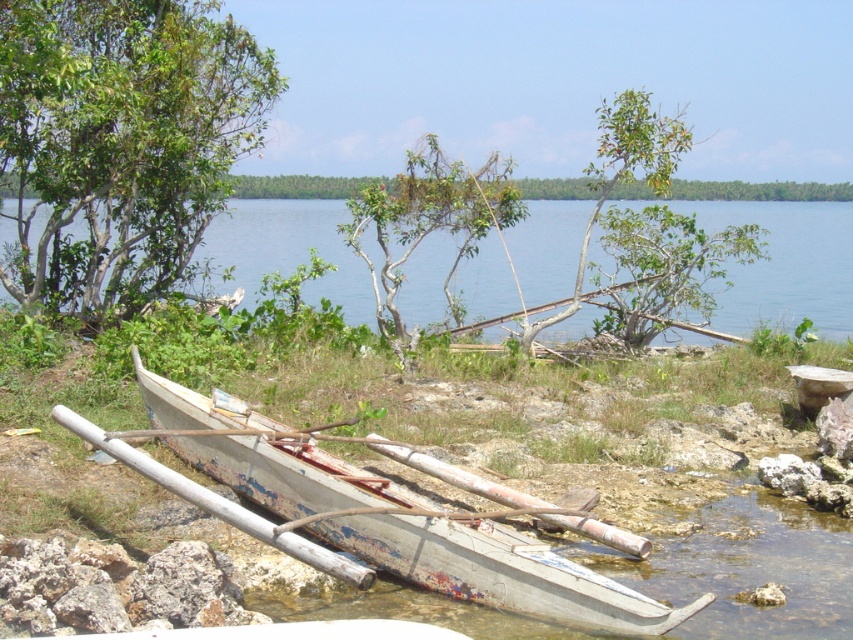
Does blue water at center appear over green leafy tree at center?

Actually, blue water at center is below green leafy tree at center.

Which is behind, point (560, 289) or point (389, 298)?

The point (560, 289) is behind.

You are a GUI agent. You are given a task and a screenshot of the screen. Output one action in this format:
    pyautogui.click(x=<x>, y=<y>)
    Task: Click on the blue water at center
    This screenshot has height=640, width=853.
    Given the screenshot: What is the action you would take?
    pyautogui.click(x=784, y=264)

Image resolution: width=853 pixels, height=640 pixels. I want to click on blue water at center, so click(784, 264).

Does white wooden boat at lower center appear on the left side of green leafy tree at center?

Correct, you'll find white wooden boat at lower center to the left of green leafy tree at center.

Can you confirm if white wooden boat at lower center is thinner than green leafy tree at center?

No.

Is point (143, 384) closer to viewer compared to point (397, 189)?

That is True.

Find the location of a particular element. Image resolution: width=853 pixels, height=640 pixels. white wooden boat at lower center is located at coordinates (498, 572).

Which is more to the left, blue water at center or white wooden boat at lower center?

white wooden boat at lower center is more to the left.

In the scene shown: Between blue water at center and white wooden boat at lower center, which one has less height?

With less height is white wooden boat at lower center.

Describe the element at coordinates (784, 264) in the screenshot. I see `blue water at center` at that location.

Locate an element on the screen. blue water at center is located at coordinates (784, 264).